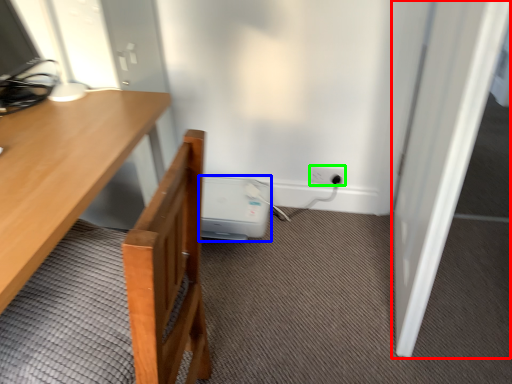
Question: Considering the real-world distances, which object is closest to door (highlighted by a red box)? water heater (highlighted by a blue box) or electric outlet (highlighted by a green box).

Choices:
 (A) water heater
 (B) electric outlet

Answer: (B)